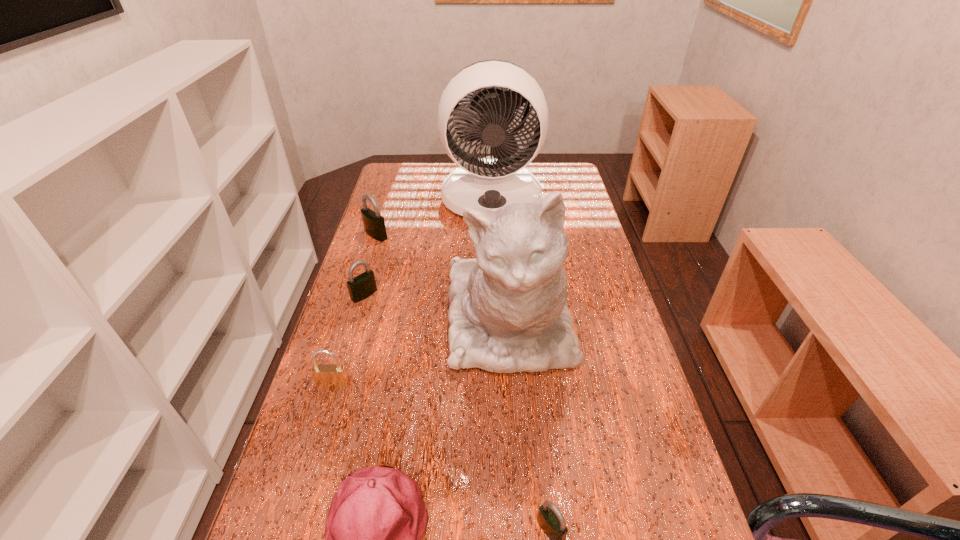
Locate an element on the screen. Image resolution: width=960 pixels, height=540 pixels. the farthest object is located at coordinates (500, 179).

I want to click on fan, so click(x=500, y=179).

This screenshot has height=540, width=960. I want to click on cat, so (508, 313).

At what (x,y) coordinates should I click in order to perform the action: click on the farthest padlock. Please return your answer as a coordinate pair (x, y). The width and height of the screenshot is (960, 540). Looking at the image, I should click on (374, 225).

The height and width of the screenshot is (540, 960). I want to click on the biggest black padlock, so click(x=374, y=225).

Locate an element on the screen. This screenshot has height=540, width=960. the second farthest padlock is located at coordinates tap(362, 286).

Locate an element on the screen. The image size is (960, 540). the second smallest black padlock is located at coordinates (362, 286).

Where is `the third farthest padlock`? This screenshot has width=960, height=540. the third farthest padlock is located at coordinates (327, 375).

Locate an element on the screen. vacant space located on the grille of the gray fan is located at coordinates (493, 264).

What are the coordinates of `vacant space located on the front-facing side of the cat` in the screenshot? It's located at (518, 455).